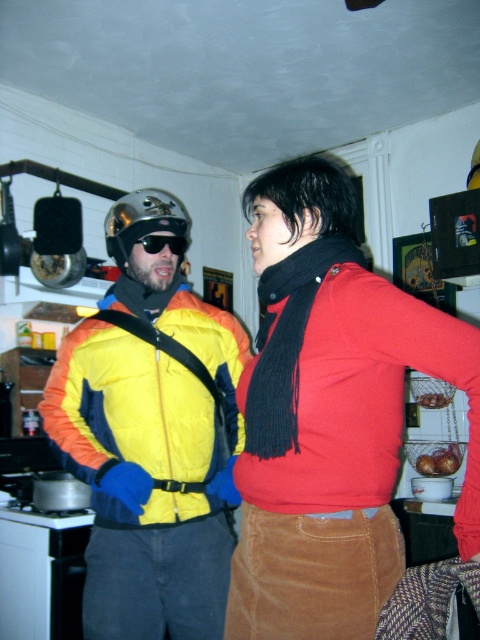
In the scene shown: Is metallic silver helmet at upper left bigger than black plastic goggles at upper left?

Correct, metallic silver helmet at upper left is larger in size than black plastic goggles at upper left.

Which of these two, metallic silver helmet at upper left or black plastic goggles at upper left, stands taller?

metallic silver helmet at upper left is taller.

In the scene shown: Who is more distant from viewer, (181, 234) or (152, 237)?

Positioned behind is point (181, 234).

The image size is (480, 640). Find the location of `metallic silver helmet at upper left`. metallic silver helmet at upper left is located at coordinates (142, 220).

Between yellow/padded jacket at center and black fuzzy scarf at center, which one appears on the left side from the viewer's perspective?

Positioned to the left is yellow/padded jacket at center.

Who is higher up, yellow/padded jacket at center or black fuzzy scarf at center?

Positioned higher is black fuzzy scarf at center.

The width and height of the screenshot is (480, 640). I want to click on yellow/padded jacket at center, so click(152, 436).

Which is more to the right, black fuzzy scarf at center or metallic silver helmet at upper left?

black fuzzy scarf at center

Between black fuzzy scarf at center and metallic silver helmet at upper left, which one is positioned higher?

metallic silver helmet at upper left is higher up.

Which is behind, point (253, 419) or point (160, 216)?

Positioned behind is point (160, 216).

At what (x,y) coordinates should I click in order to perform the action: click on black fuzzy scarf at center. Please return your answer as a coordinate pair (x, y). Looking at the image, I should click on (287, 342).